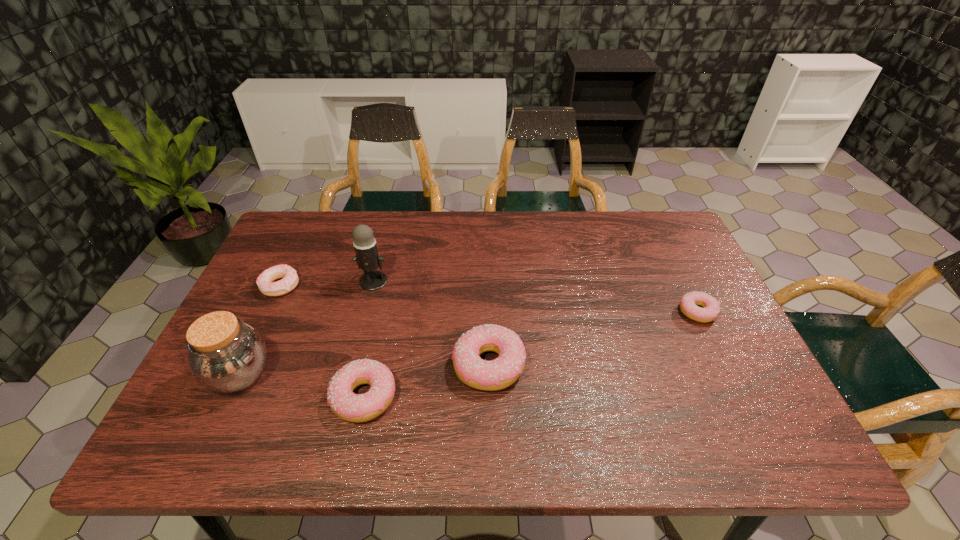
Locate an element on the screen. vacant space that satisfies the following two spatial constraints: 1. on the front side of the tallest object; 2. on the left side of the fifth object from left to right is located at coordinates (352, 365).

I want to click on vacant region that satisfies the following two spatial constraints: 1. on the front side of the tallest object; 2. on the left side of the rightmost doughnut, so click(x=367, y=312).